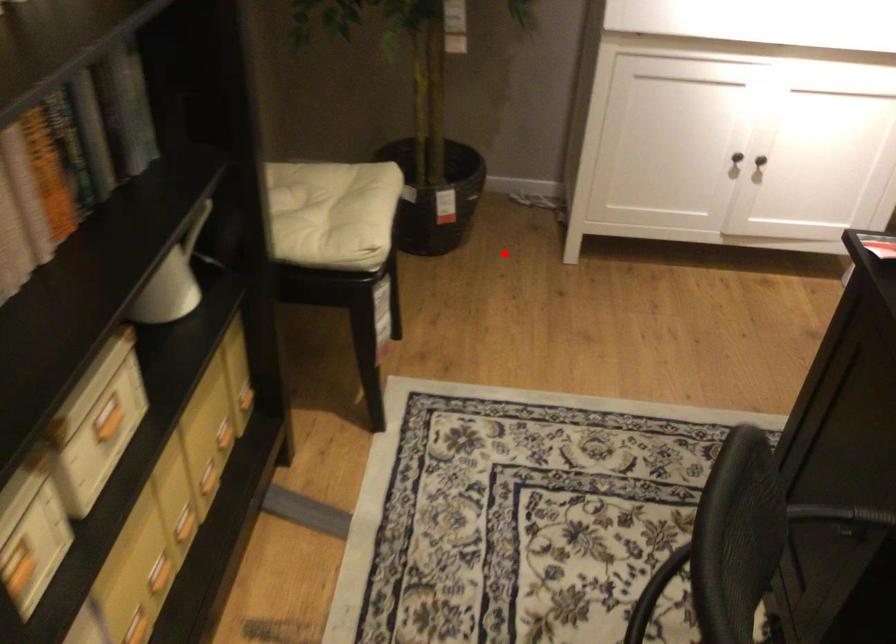
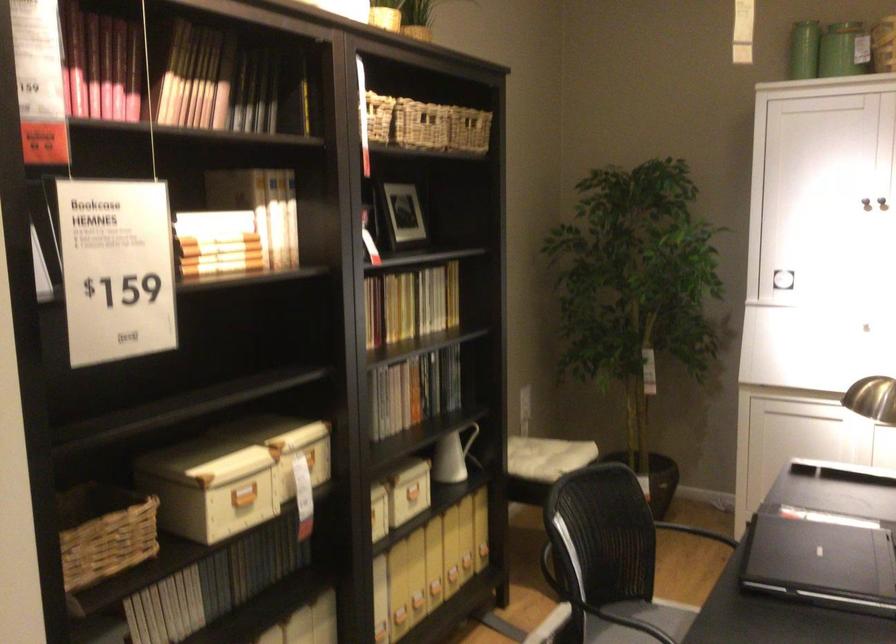
Find the pixel in the second image that matches the highlighted location in the first image.

(695, 532)